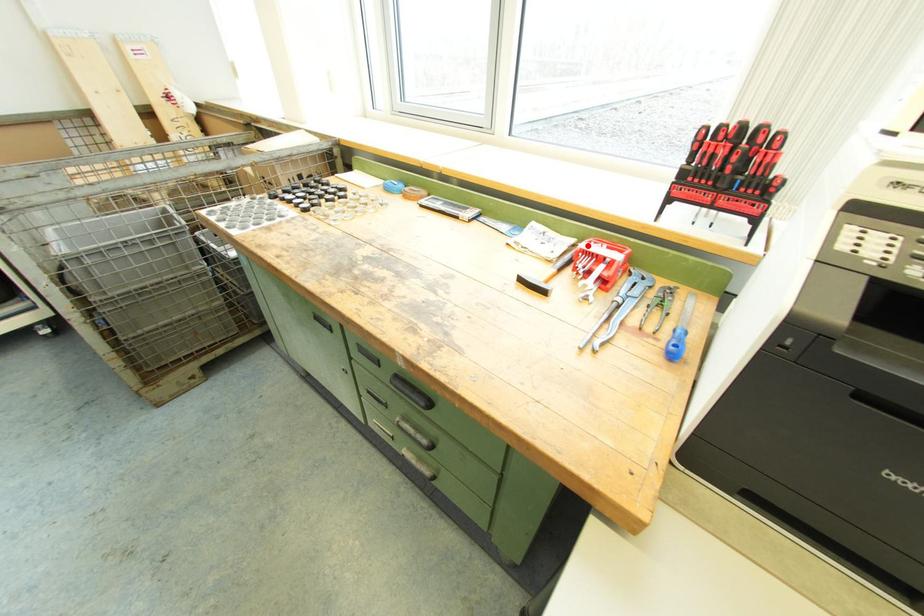
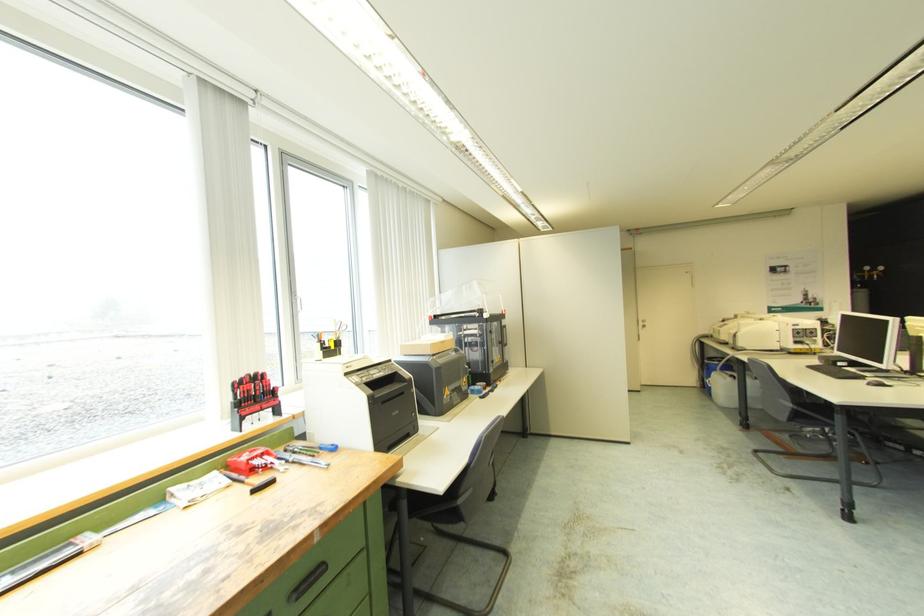
Where in the second image is the point corresponding to the highlighted location from the first image?

(248, 458)